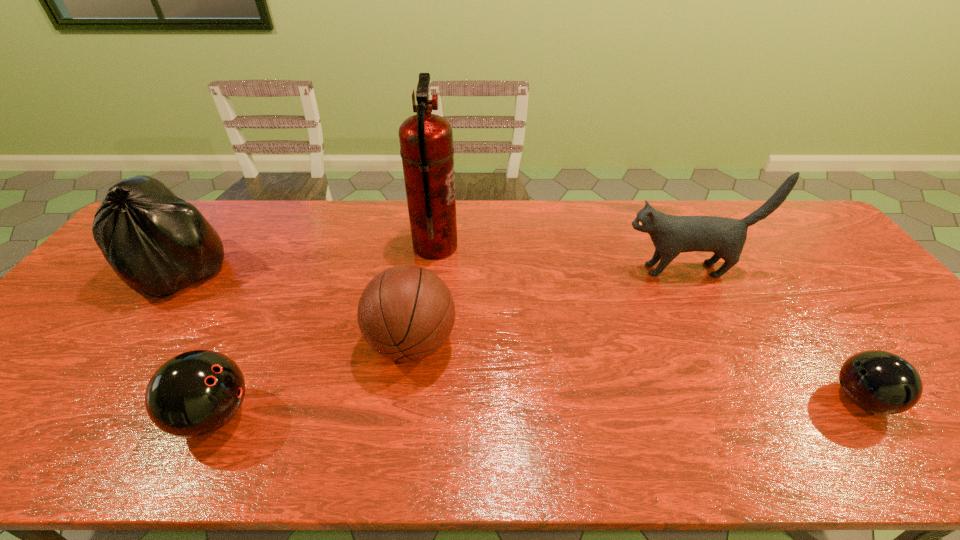
At what (x,y) coordinates should I click in order to perform the action: click on free location located at the face of the cat. Please return your answer as a coordinate pair (x, y). Looking at the image, I should click on (521, 269).

Where is `vacant space located at the face of the cat`? The height and width of the screenshot is (540, 960). vacant space located at the face of the cat is located at coordinates (565, 269).

The image size is (960, 540). What are the coordinates of `blank area located 0.180m on the back of the leftmost object` in the screenshot? It's located at (227, 208).

The width and height of the screenshot is (960, 540). I want to click on vacant region located on the left of the basketball, so click(311, 343).

Find the location of a particular element. The height and width of the screenshot is (540, 960). vacant space located on the surface of the left bowling ball near the finger holes is located at coordinates (369, 415).

Locate an element on the screen. This screenshot has height=540, width=960. vacant space located 0.080m on the side of the shorter bowling ball with the finger holes is located at coordinates (796, 399).

In order to click on free location located on the side of the shorter bowling ball with the finger holes in this screenshot , I will do `click(707, 399)`.

This screenshot has height=540, width=960. Identify the location of vacant space located 0.100m on the side of the shorter bowling ball with the finger holes. (787, 399).

This screenshot has width=960, height=540. What are the coordinates of `fire extinguisher that is positioned at the far edge` in the screenshot? It's located at (426, 140).

You are a GUI agent. You are given a task and a screenshot of the screen. Output one action in this format:
    pyautogui.click(x=<x>, y=<y>)
    Task: Click on the plastic bag that is at the far edge
    The width and height of the screenshot is (960, 540).
    Given the screenshot: What is the action you would take?
    pyautogui.click(x=157, y=243)